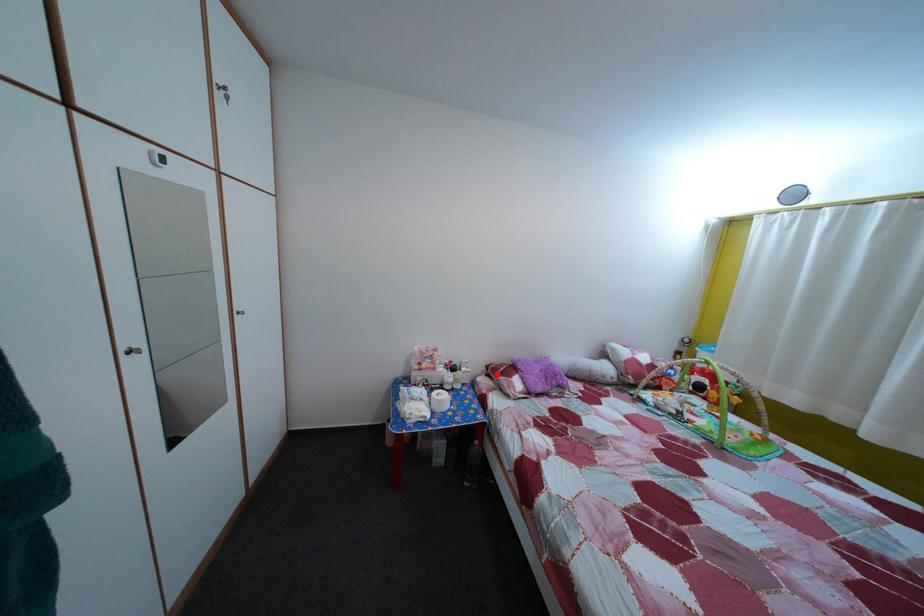
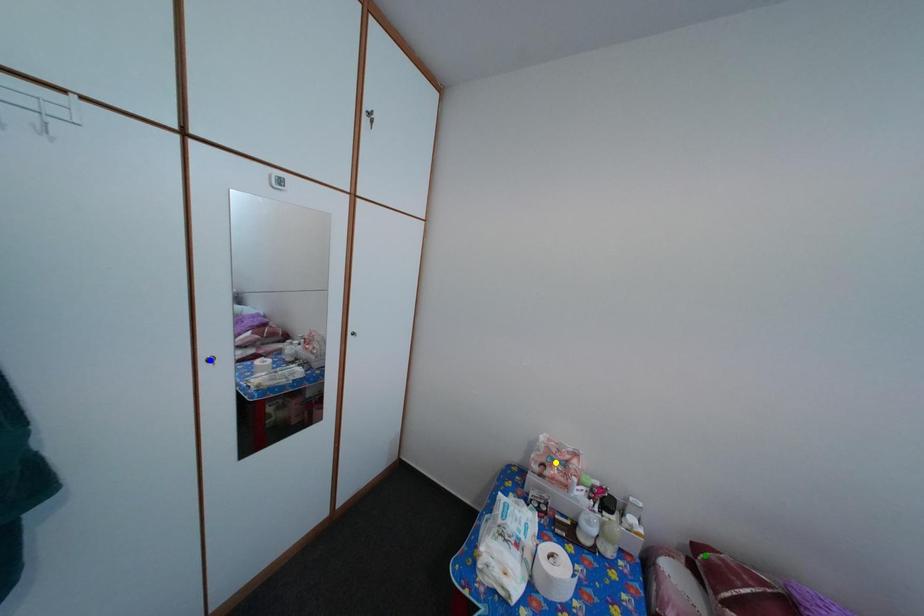
Question: I am providing you with two images of the same scene from different viewpoints. A red point is marked on the first image. You are given multiple points on the second image. Which mark in image 2 goes with the point in image 1?

Choices:
 (A) yellow point
 (B) green point
 (C) blue point

Answer: (B)